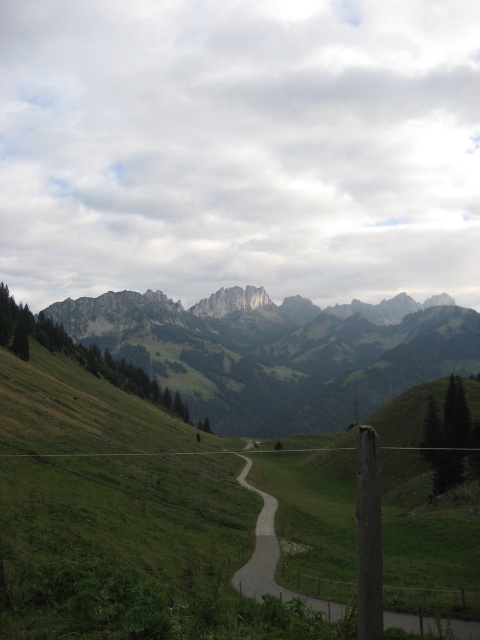
You are a hiker planning to take a photo of the rugged stone mountains at upper center from the road in the foreground. Based on their position, can you determine if the mountains will be fully visible in your photo if you stand at the starting point of the road?

The rugged stone mountains at upper center are located at coordinates approximately 0.558 on the x and 0.575 on the y axis. Since the mountains are positioned centrally in the upper part of the image, they should be fully visible in the photo taken from the road starting point.

You are standing at the point closer to the camera between the two points, point (x=298, y=330) and point (x=275, y=564). Looking towards the mountains in the background, which direction should you turn to face the other point?

You should turn to your right to face point (x=275, y=564) because point (x=298, y=330) is closer to you and the other point is further away but located to the right side.